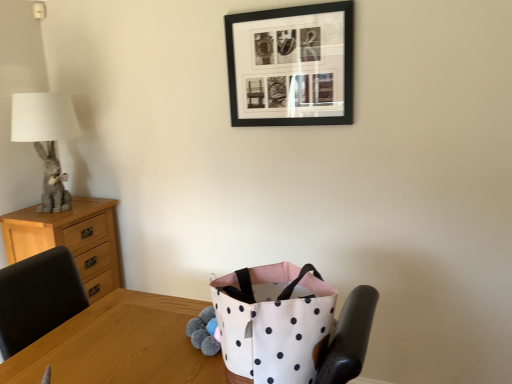
Question: Considering the relative sizes of light wood chest of drawers at left and black matte picture frame at upper center in the image provided, is light wood chest of drawers at left wider than black matte picture frame at upper center?

Choices:
 (A) no
 (B) yes

Answer: (B)

Question: Is light wood chest of drawers at left positioned beyond the bounds of black matte picture frame at upper center?

Choices:
 (A) no
 (B) yes

Answer: (B)

Question: Is black matte picture frame at upper center at the back of light wood chest of drawers at left?

Choices:
 (A) yes
 (B) no

Answer: (B)

Question: Is light wood chest of drawers at left smaller than black matte picture frame at upper center?

Choices:
 (A) yes
 (B) no

Answer: (B)

Question: Is light wood chest of drawers at left positioned before black matte picture frame at upper center?

Choices:
 (A) yes
 (B) no

Answer: (B)

Question: Does point (5, 296) appear closer or farther from the camera than point (36, 215)?

Choices:
 (A) closer
 (B) farther

Answer: (A)

Question: Is black leather chair at left wider or thinner than light wood chest of drawers at left?

Choices:
 (A) thin
 (B) wide

Answer: (A)

Question: Based on their sizes in the image, would you say black leather chair at left is bigger or smaller than light wood chest of drawers at left?

Choices:
 (A) big
 (B) small

Answer: (B)

Question: From their relative heights in the image, would you say black leather chair at left is taller or shorter than light wood chest of drawers at left?

Choices:
 (A) short
 (B) tall

Answer: (A)

Question: Is point (54, 157) positioned closer to the camera than point (39, 367)?

Choices:
 (A) farther
 (B) closer

Answer: (A)

Question: From the image's perspective, is gray plush rabbit at left above or below white fabric bag at center?

Choices:
 (A) above
 (B) below

Answer: (A)

Question: In terms of height, does gray plush rabbit at left look taller or shorter compared to white fabric bag at center?

Choices:
 (A) short
 (B) tall

Answer: (B)

Question: Is gray plush rabbit at left spatially inside white fabric bag at center, or outside of it?

Choices:
 (A) inside
 (B) outside

Answer: (B)

Question: Considering the positions of point (14, 140) and point (15, 327), is point (14, 140) closer or farther from the camera than point (15, 327)?

Choices:
 (A) closer
 (B) farther

Answer: (B)

Question: From a real-world perspective, is gray plush rabbit at left positioned above or below black leather chair at left?

Choices:
 (A) above
 (B) below

Answer: (A)